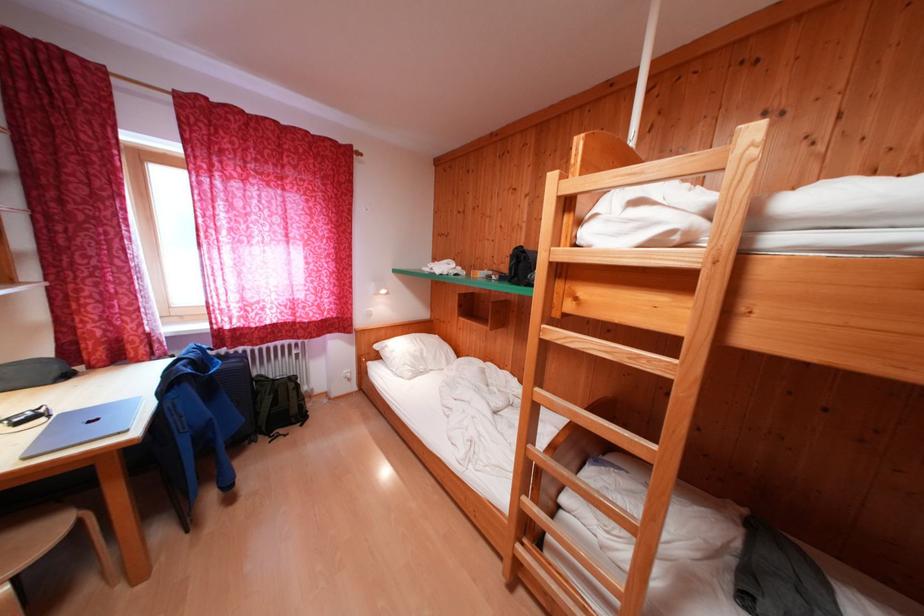
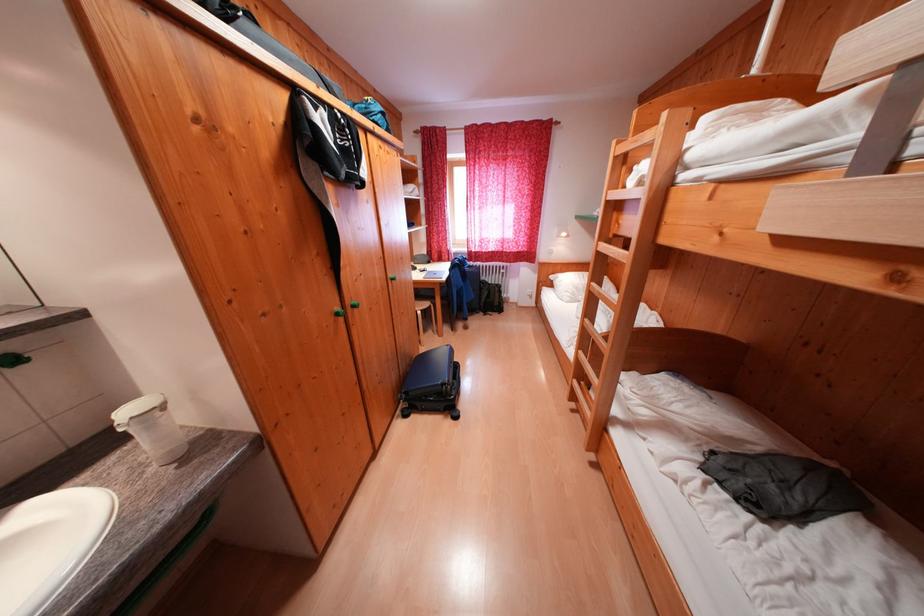
Find the pixel in the second image that matches point (426, 358) in the first image.

(589, 291)